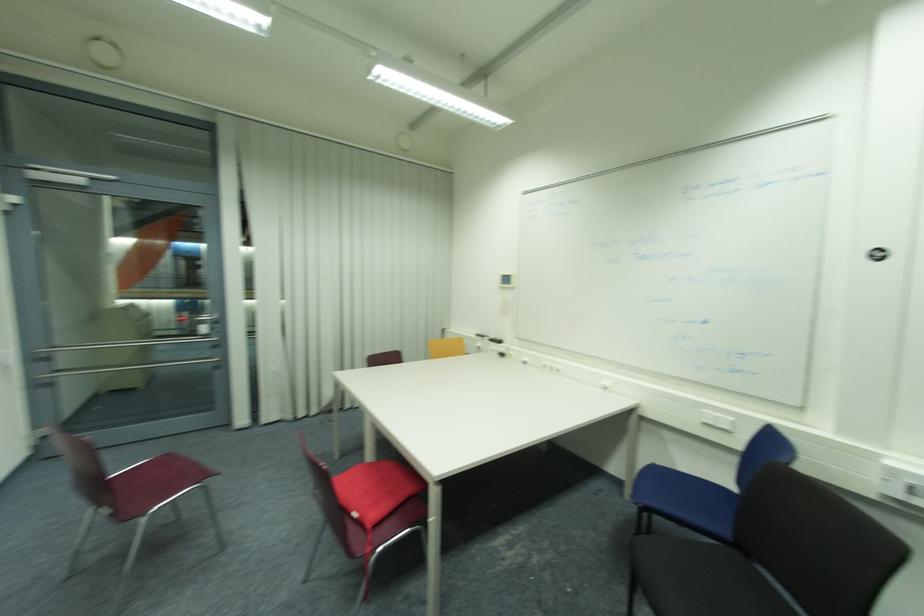
In order to click on metal door handle in this screenshot , I will do `click(205, 323)`.